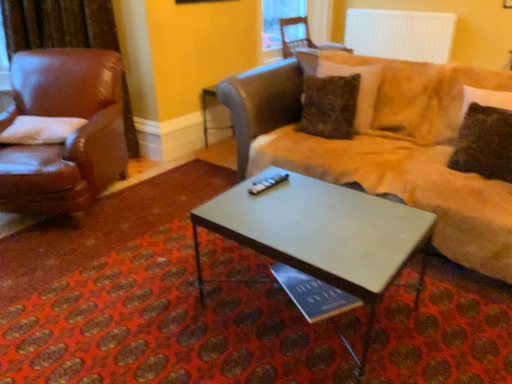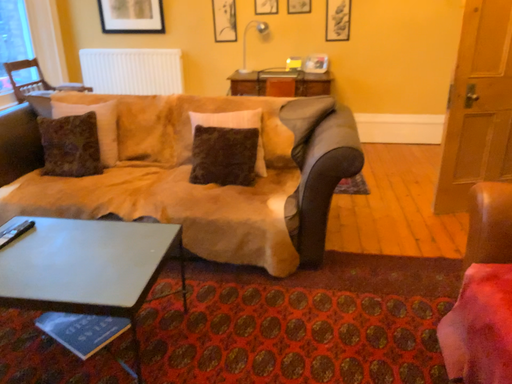
Question: Which way did the camera rotate in the video?

Choices:
 (A) rotated right
 (B) rotated left

Answer: (A)